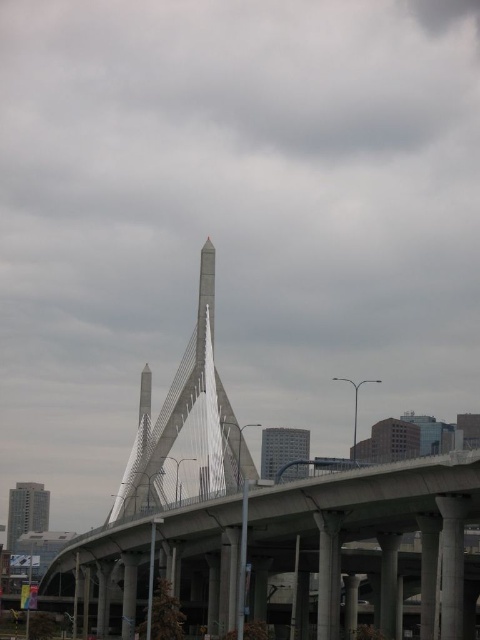
Is point (459, 627) farther from camera compared to point (233, 493)?

No, (459, 627) is in front of (233, 493).

Does white metallic pedestrian bridge at center appear on the left side of concrete bridge at center?

No, white metallic pedestrian bridge at center is not to the left of concrete bridge at center.

Find the location of `white metallic pedestrian bridge at center`. white metallic pedestrian bridge at center is located at coordinates (269, 520).